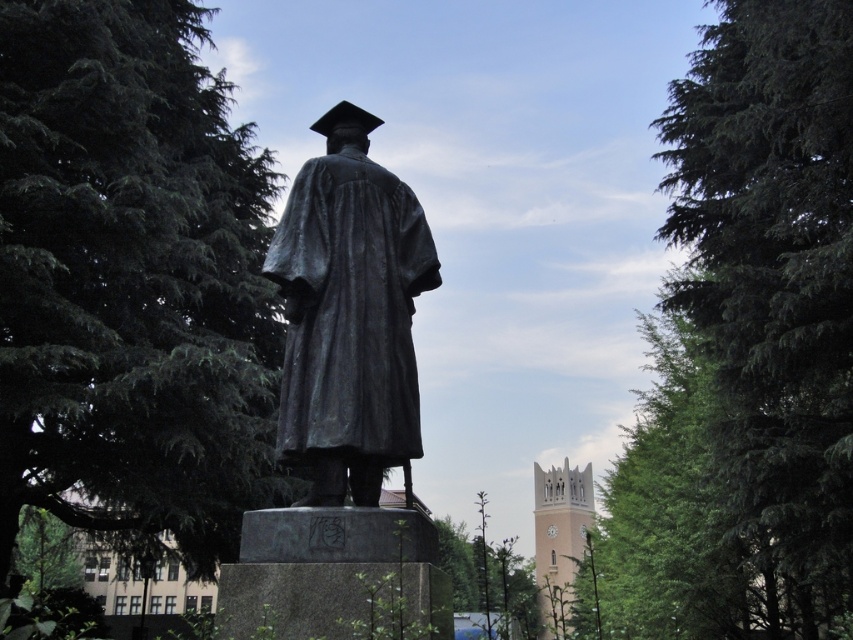
Who is positioned more to the right, green textured leaves at upper left or bronze/textured statue at center?

Positioned to the right is bronze/textured statue at center.

Is green textured leaves at upper left positioned behind bronze/textured statue at center?

Yes, green textured leaves at upper left is further from the viewer.

Image resolution: width=853 pixels, height=640 pixels. Identify the location of green textured leaves at upper left. (131, 276).

Describe the element at coordinates (131, 276) in the screenshot. I see `green textured leaves at upper left` at that location.

Between point (144, 29) and point (676, 108), which one is positioned behind?

The point (676, 108) is behind.

Which is in front, point (88, 484) or point (801, 477)?

Point (801, 477) is in front.

Where is `green textured leaves at upper left`? Image resolution: width=853 pixels, height=640 pixels. green textured leaves at upper left is located at coordinates (131, 276).

Looking at this image, is green textured tree at right bigger than bronze/textured statue at center?

Yes, green textured tree at right is bigger than bronze/textured statue at center.

Locate an element on the screen. The height and width of the screenshot is (640, 853). green textured tree at right is located at coordinates (772, 285).